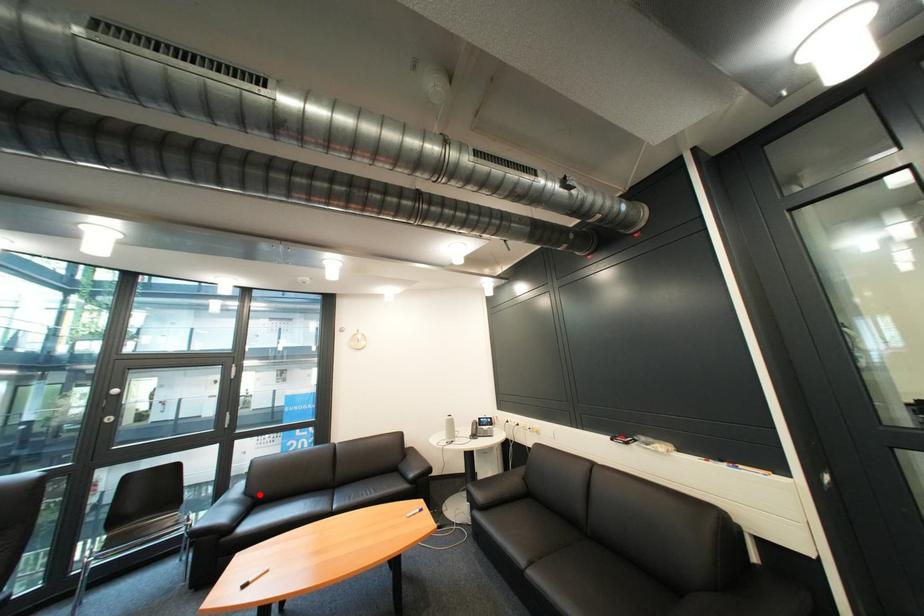
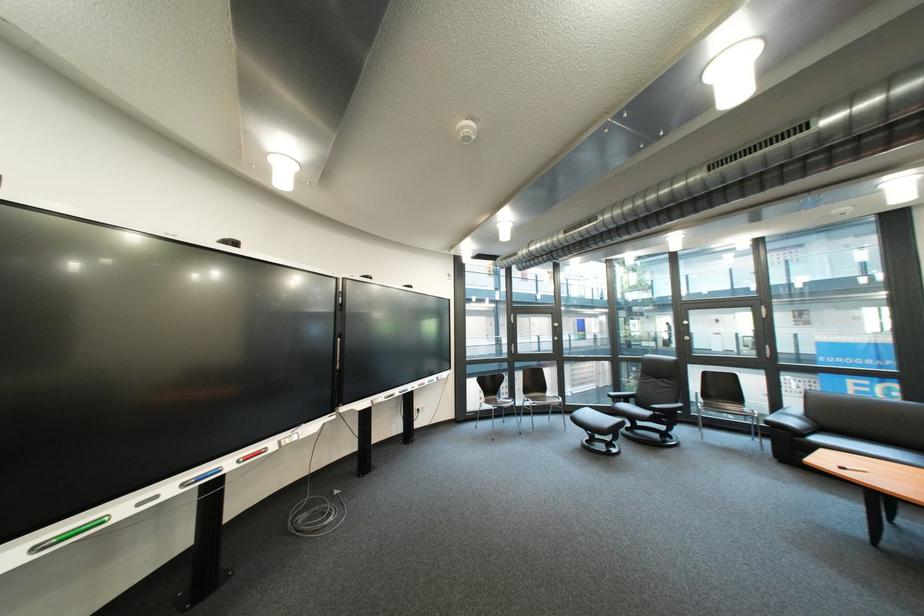
Question: I am providing you with two images of the same scene from different viewpoints. A red point is shown in image1. For the corresponding object point in image2, is it positioned nearer or farther from the camera?

Choices:
 (A) Nearer
 (B) Farther

Answer: (A)